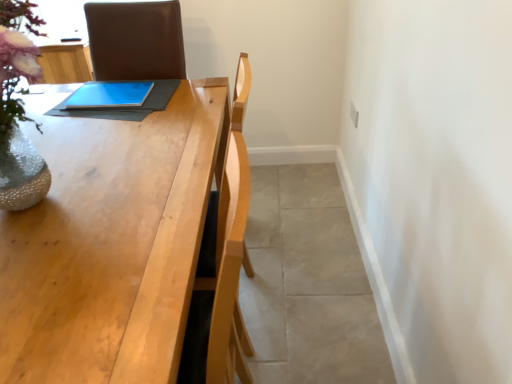
Where is `vacant space in front of blue matte tablet at center`? The height and width of the screenshot is (384, 512). vacant space in front of blue matte tablet at center is located at coordinates (101, 118).